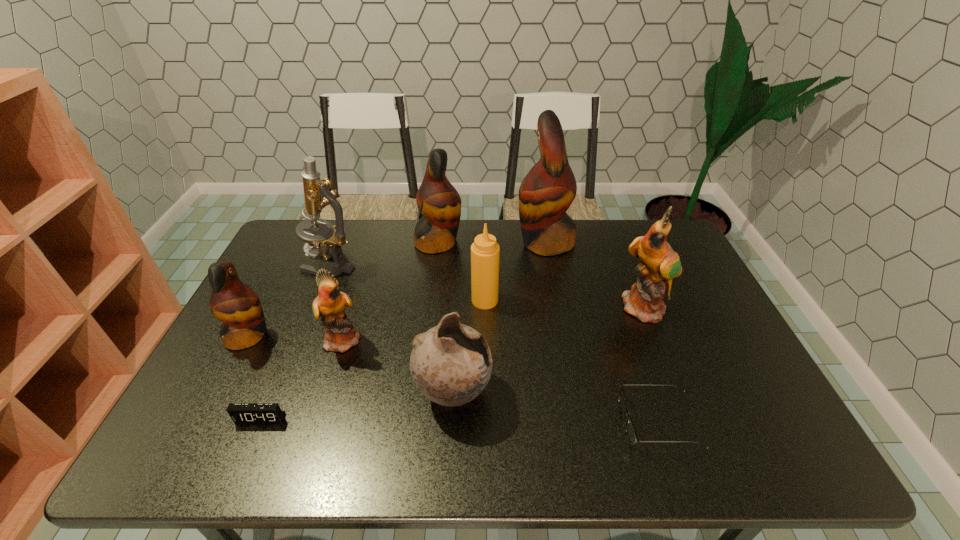
Identify the location of the leftmost parrot. (236, 304).

This screenshot has width=960, height=540. In order to click on the smallest red parrot in this screenshot , I will do [x=236, y=304].

Identify the location of pottery. (451, 363).

Image resolution: width=960 pixels, height=540 pixels. I want to click on alarm clock, so click(241, 413).

This screenshot has width=960, height=540. I want to click on spectacles, so click(631, 433).

Locate an element on the screen. vacant space located 0.180m on the face of the tallest parrot is located at coordinates (465, 242).

The image size is (960, 540). Find the location of `free point located on the face of the tallest parrot`. free point located on the face of the tallest parrot is located at coordinates (444, 242).

Identify the location of free space located 0.100m on the face of the tallest parrot. This screenshot has height=540, width=960. click(x=487, y=242).

Find the location of `free space located on the front of the microscope`. free space located on the front of the microscope is located at coordinates tap(285, 379).

The image size is (960, 540). I want to click on free region located on the face of the second red parrot from right to left, so click(519, 242).